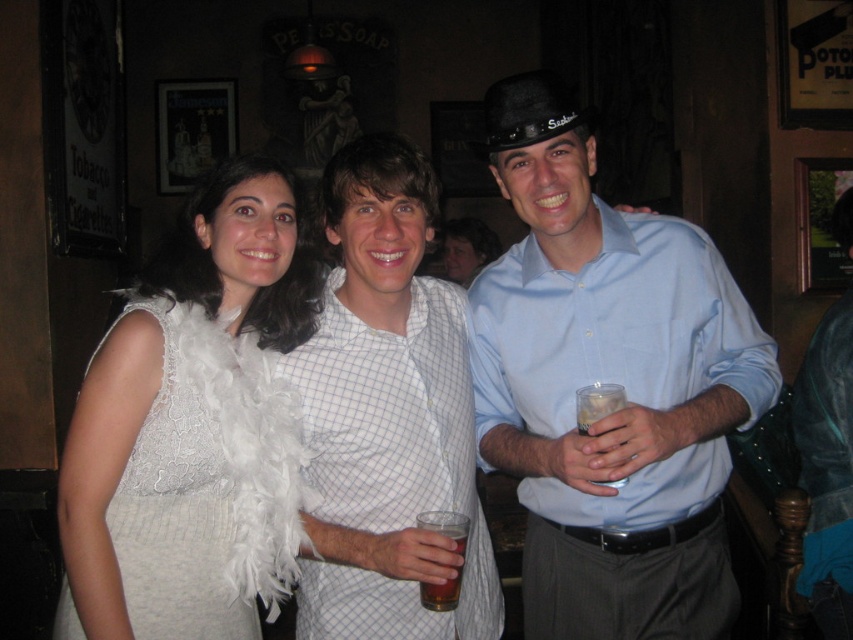
In the scene shown: You are taking a photo of two points in the bar scene. The first point is at coordinates point (437, 512) and the second is at point (608, 484). Which point is closer to the camera?

Point (437, 512) is closer to the camera than point (608, 484).